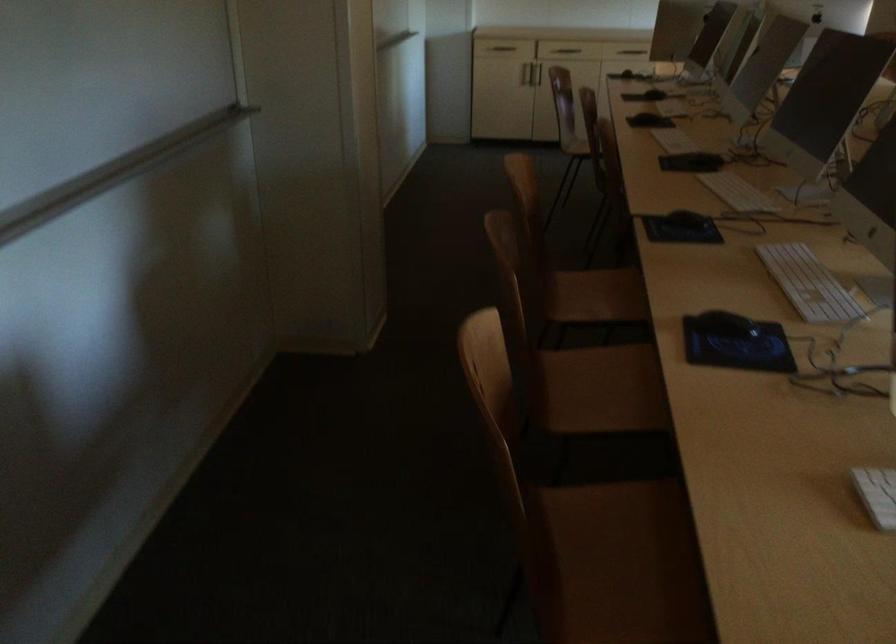
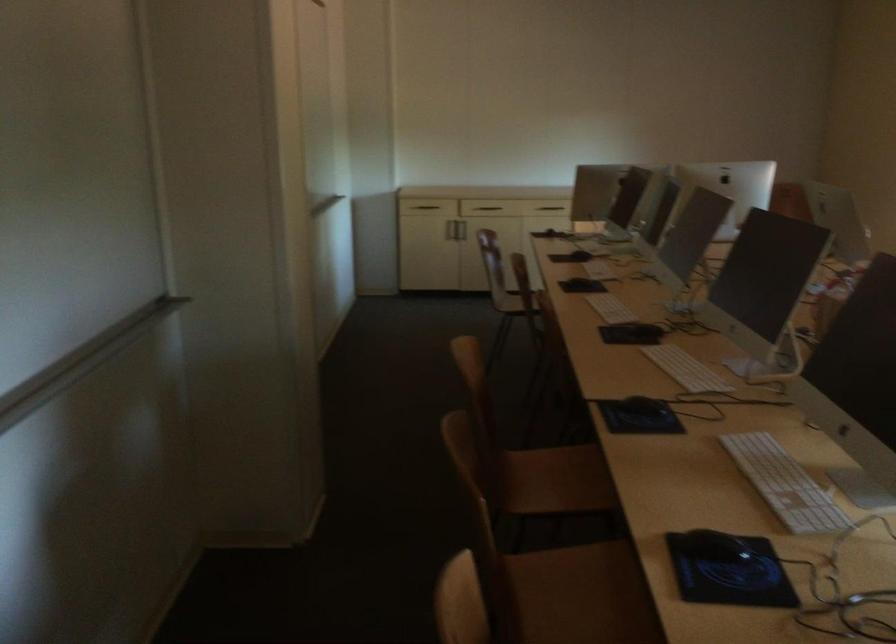
Locate, in the second image, the point that corresponds to the point at 691,218 in the first image.

(648, 406)